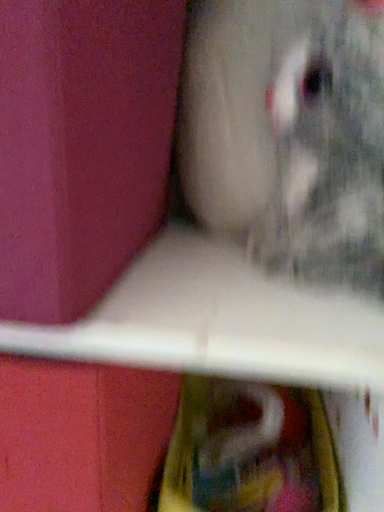
Question: Is fuzzy gray cat at upper right positioned beyond the bounds of matte pink box at left?

Choices:
 (A) yes
 (B) no

Answer: (A)

Question: Is fuzzy gray cat at upper right to the left of matte pink box at left from the viewer's perspective?

Choices:
 (A) yes
 (B) no

Answer: (B)

Question: Does fuzzy gray cat at upper right have a lesser width compared to matte pink box at left?

Choices:
 (A) no
 (B) yes

Answer: (B)

Question: From the image's perspective, would you say fuzzy gray cat at upper right is positioned over matte pink box at left?

Choices:
 (A) no
 (B) yes

Answer: (A)

Question: From the image's perspective, would you say fuzzy gray cat at upper right is shown under matte pink box at left?

Choices:
 (A) no
 (B) yes

Answer: (B)

Question: Can you confirm if fuzzy gray cat at upper right is taller than matte pink box at left?

Choices:
 (A) yes
 (B) no

Answer: (A)

Question: From the image's perspective, is matte pink box at left below fuzzy gray cat at upper right?

Choices:
 (A) no
 (B) yes

Answer: (A)

Question: Is matte pink box at left looking in the opposite direction of fuzzy gray cat at upper right?

Choices:
 (A) yes
 (B) no

Answer: (B)

Question: Would you say matte pink box at left contains fuzzy gray cat at upper right?

Choices:
 (A) yes
 (B) no

Answer: (B)

Question: Is matte pink box at left aimed at fuzzy gray cat at upper right?

Choices:
 (A) yes
 (B) no

Answer: (B)

Question: Can you confirm if matte pink box at left is taller than fuzzy gray cat at upper right?

Choices:
 (A) no
 (B) yes

Answer: (A)

Question: Can you confirm if matte pink box at left is thinner than fuzzy gray cat at upper right?

Choices:
 (A) yes
 (B) no

Answer: (B)

Question: From the image's perspective, is matte pink box at left above or below fuzzy gray cat at upper right?

Choices:
 (A) below
 (B) above

Answer: (B)